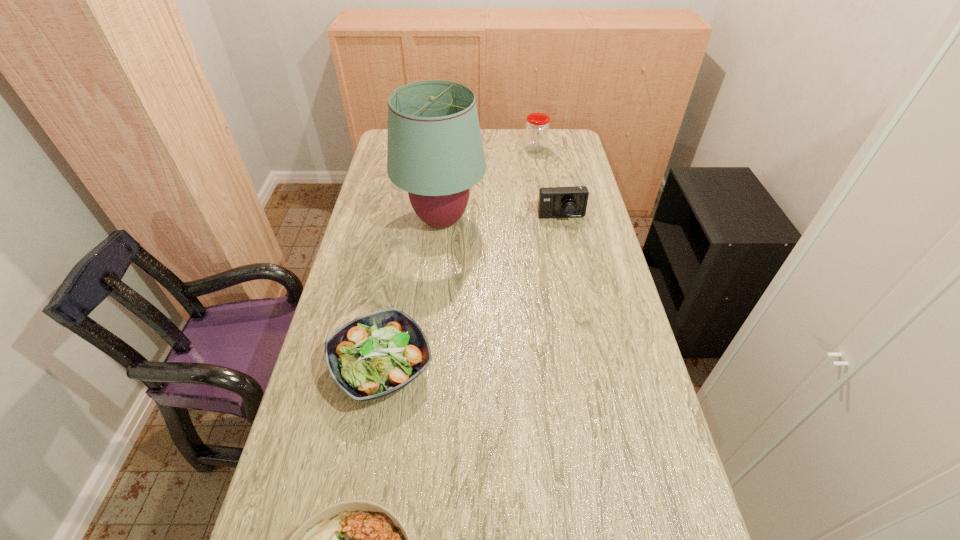
Where is `object that is at the far edge`? object that is at the far edge is located at coordinates (537, 127).

In order to click on lampshade that is at the left edge in this screenshot , I will do `click(435, 152)`.

Locate an element on the screen. The height and width of the screenshot is (540, 960). salad plate present at the left edge is located at coordinates (372, 356).

I want to click on jar positioned at the right edge, so click(x=537, y=127).

You are a GUI agent. You are given a task and a screenshot of the screen. Output one action in this format:
    pyautogui.click(x=<x>, y=<y>)
    Task: Click on the camera located at the right edge
    Image resolution: width=960 pixels, height=540 pixels.
    Given the screenshot: What is the action you would take?
    pyautogui.click(x=554, y=202)

This screenshot has height=540, width=960. I want to click on object positioned at the far right corner, so click(537, 127).

I want to click on blank space at the far edge of the desktop, so click(481, 131).

In the image, there is a desktop. At what (x,y) coordinates should I click in order to perform the action: click on vacant space at the left edge. Please return your answer as a coordinate pair (x, y). The height and width of the screenshot is (540, 960). Looking at the image, I should click on (396, 209).

In the image, there is a desktop. Identify the location of vacant space at the right edge. click(605, 412).

Image resolution: width=960 pixels, height=540 pixels. What are the coordinates of `blank space at the far left corner of the desktop` in the screenshot? It's located at point(381,155).